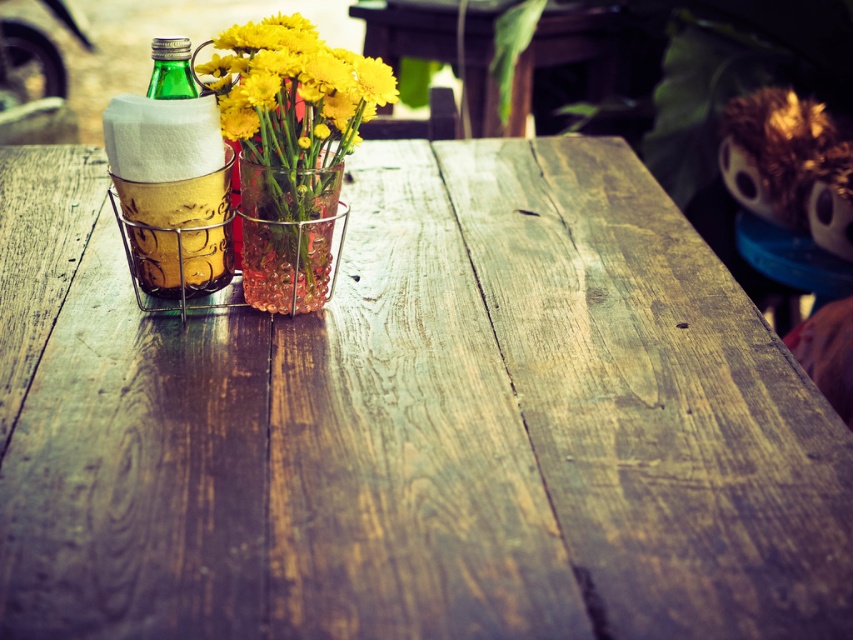
You are arranging flowers for a centerpiece and need to place the translucent glass vase at center and the green glass bottle at upper left on the rustic wooden table. The floral arrangement requires the two items to be at least 10 centimeters apart. Can you confirm if they meet the spacing requirement?

The distance between the translucent glass vase at center and the green glass bottle at upper left is 10.23 centimeters, which meets the required spacing of at least 10 centimeters. Therefore, the arrangement is suitable for the floral centerpiece.

You are setting up a centerpiece for a rustic table. You have a green glass bottle at left and a clear glass vase at center. According to the scene, which item is placed to the left of the other?

The green glass bottle at left is positioned on the left side of the clear glass vase at center.

You are setting up a centerpiece for a dinner party and want to place a decorative item between the green glass bottle at left and the clear glass vase at center. The item you have is 3 inches long. Will it fit in the space between them?

The space between the green glass bottle at left and the clear glass vase at center is 2.70 inches. Since the item is 3 inches long, it will not fit in the space between them.